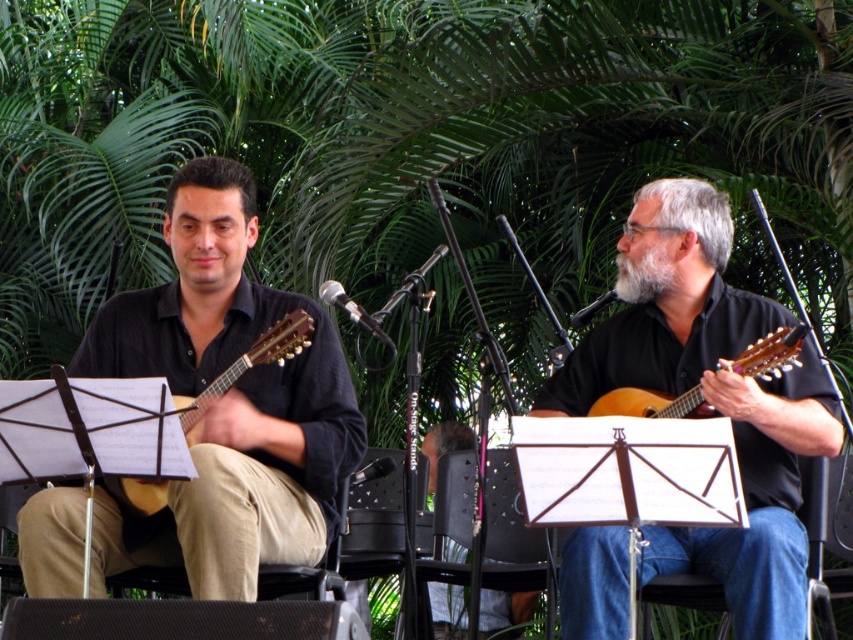
Based on the scene description, which guitar is taller, the matte black guitar at center or the matte wood guitar at right?

The matte black guitar at center is taller than the matte wood guitar at right.

You are a sound engineer setting up microphones for the two guitarists. The minimum distance required between microphones to avoid feedback is 1.5 meters. Can you safely place the microphones between the wooden acoustic guitar at left and the matte wood guitar at right?

The wooden acoustic guitar at left and matte wood guitar at right are 1.43 meters apart from each other. Since the required minimum distance to avoid feedback is 1.5 meters, placing the microphones between them would not be safe as the distance is insufficient.

You are a stagehand setting up equipment for a performance. You have two guitars on stage, the matte black guitar at center and the wooden acoustic guitar at left. The stage has a narrow passage between the two guitars that is 1.2 meters wide. Can a 1.1 meter wide equipment cart pass through the passage between them?

The matte black guitar at center might be wider than wooden acoustic guitar at left. Since the passage is 1.2 meters wide and the cart is 1.1 meters wide, it is possible the cart can pass if the combined width of the guitars does not exceed the passage width. However, since the matte black guitar might be wider, there is uncertainty. The stagehand should measure the guitars to confirm.